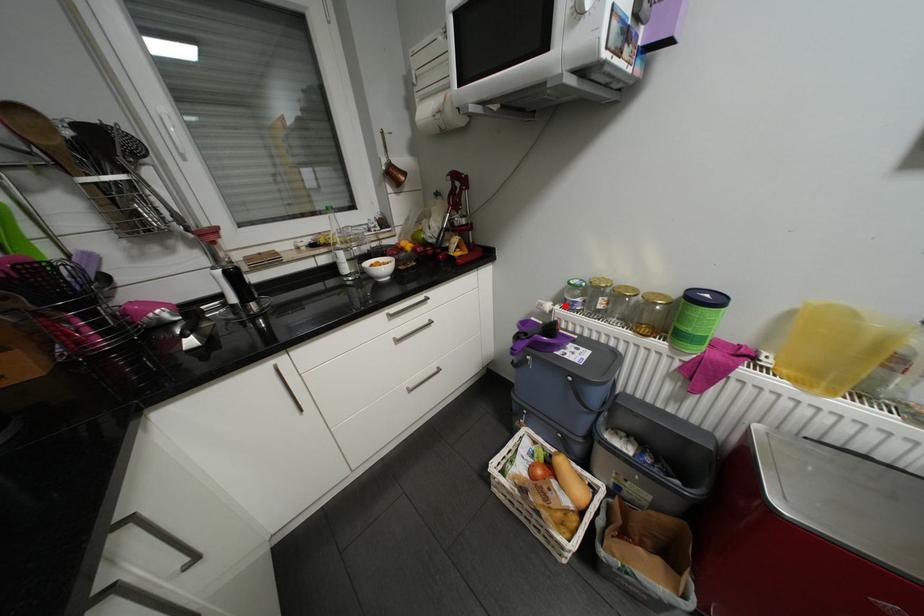
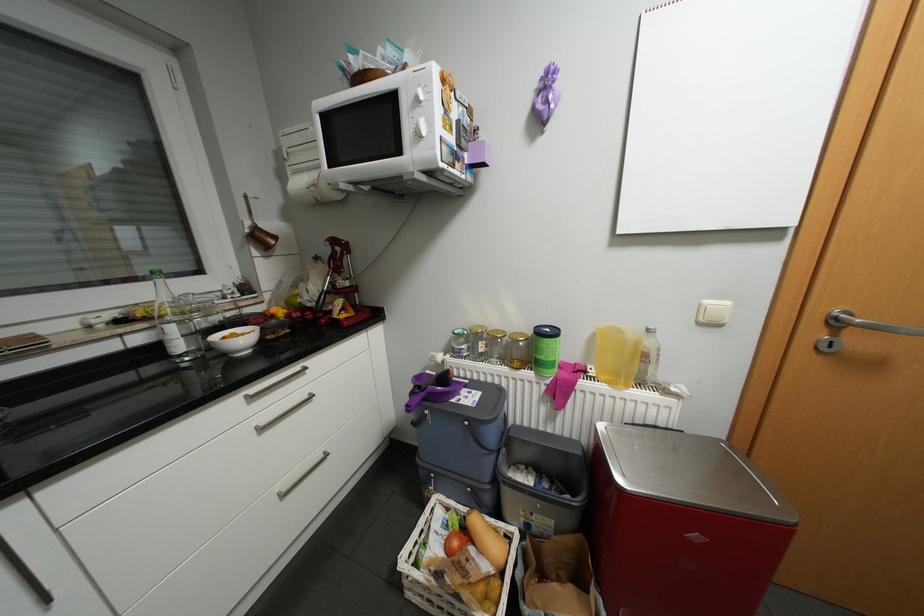
Where in the second image is the point corresponding to the highlighted location from the first image?

(456, 355)